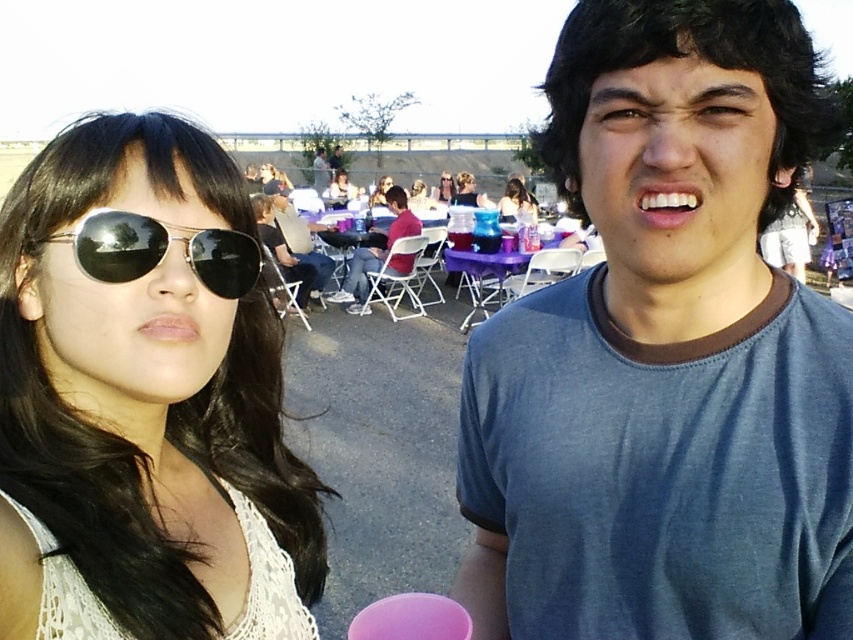
You are standing at the camera position and want to hand the matte black sunglasses at upper left to a friend who is 1.5 meters tall. Can your friend reach the sunglasses without any assistance?

The matte black sunglasses at upper left are 13.84 meters away from the camera. Since the distance is too far, your friend cannot reach them without assistance.

You are a photographer trying to capture a closeup shot of the matte black sunglasses at center. The matte black hair at upper center is blocking your view. Can you move closer to the sunglasses without moving past the person wearing them?

The matte black hair at upper center is further to the viewer than matte black sunglasses at center, which means the sunglasses are behind the hair. Moving closer to the sunglasses would require moving past the person wearing them to get around the hair obstruction.

You are taking a photo of the scene and need to ensure both the woman with aviator sunglasses and the matte black hair at center are in focus. Based on their positions, which object should you adjust your camera focus towards first?

The matte black hair at center is located at point (515, 200), so you should adjust your camera focus towards the matte black hair at center first to ensure both subjects are in focus.